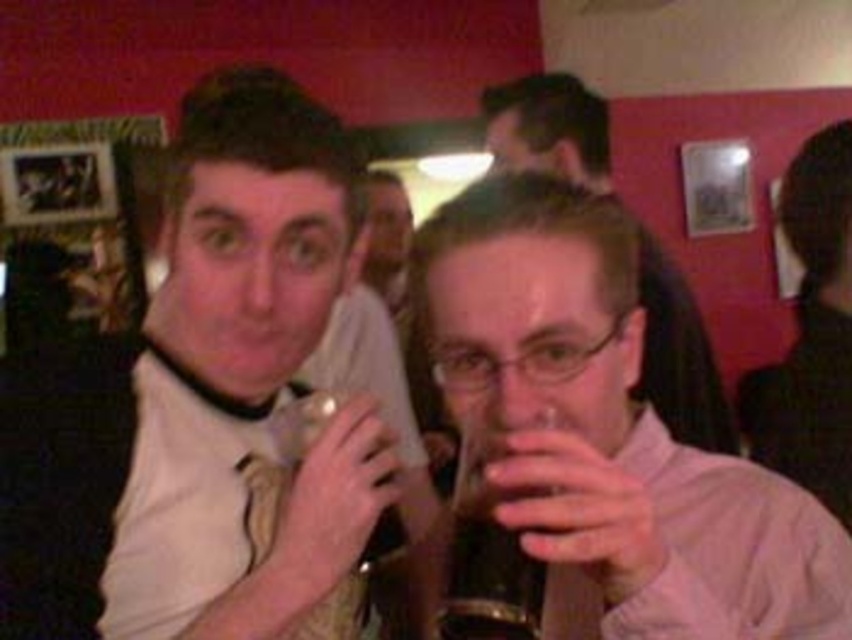
Question: Which point is farther from the camera taking this photo?

Choices:
 (A) (704, 448)
 (B) (459, 625)
 (C) (819, 257)
 (D) (799, 497)

Answer: (C)

Question: Can you confirm if smooth black hair at upper right is positioned to the right of matte black hair at center?

Choices:
 (A) no
 (B) yes

Answer: (B)

Question: Does matte black hair at center have a smaller size compared to translucent glass beer at center?

Choices:
 (A) no
 (B) yes

Answer: (A)

Question: Which point is closer to the camera?

Choices:
 (A) white matte shirt at left
 (B) translucent glass beer at center
 (C) translucent glass mug at center

Answer: (C)

Question: Observing the image, what is the correct spatial positioning of translucent glass mug at center in reference to smooth black hair at upper right?

Choices:
 (A) right
 (B) left

Answer: (B)

Question: Which point is farther from the camera taking this photo?

Choices:
 (A) (61, 362)
 (B) (458, 480)

Answer: (A)